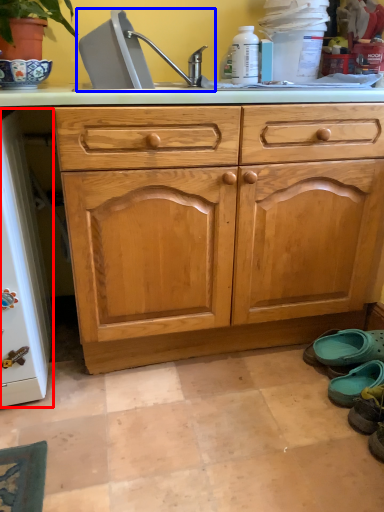
Question: Among these objects, which one is nearest to the camera, appliance (highlighted by a red box) or sink (highlighted by a blue box)?

Choices:
 (A) appliance
 (B) sink

Answer: (A)